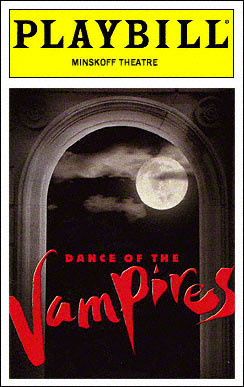
This screenshot has width=244, height=387. I want to click on book, so click(138, 113).